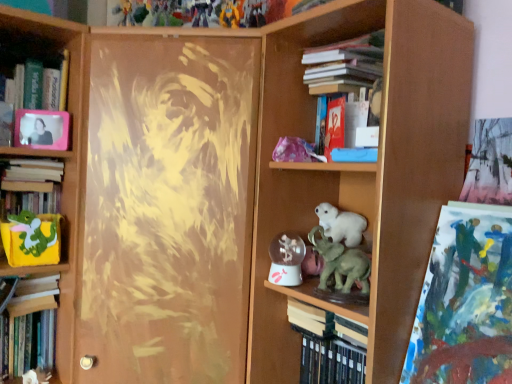
Question: Considering the positions of red matte book at upper center, the second paperback book when ordered from back to front, and abstract acrylic painting at upper right in the image, is red matte book at upper center, the second paperback book when ordered from back to front, taller or shorter than abstract acrylic painting at upper right?

Choices:
 (A) tall
 (B) short

Answer: (B)

Question: From a real-world perspective, is red matte book at upper center, which is the first paperback book from top to bottom, positioned above or below abstract acrylic painting at upper right?

Choices:
 (A) below
 (B) above

Answer: (B)

Question: Which object is the closest to the red matte book at upper center, which is the first paperback book from top to bottom?

Choices:
 (A) wooden bookcase at center
 (B) pink plastic picture frame at upper left
 (C) black matte book at center, which is counted as the second book, starting from the right
 (D) hardcover book at left, the fifth book from the right
 (E) hardcover book at center, the 2th paperback book viewed from the front

Answer: (A)

Question: Which of these objects is positioned closest to the pink plastic frame at upper left, acting as the third book starting from the left?

Choices:
 (A) abstract acrylic painting at upper right
 (B) wooden bookcase at center
 (C) black matte book at center, placed as the fourth book when sorted from left to right
 (D) red matte book at upper center, which is the first paperback book from top to bottom
 (E) matte green plush toy at left, which is the 2th animal from front to back

Answer: (E)